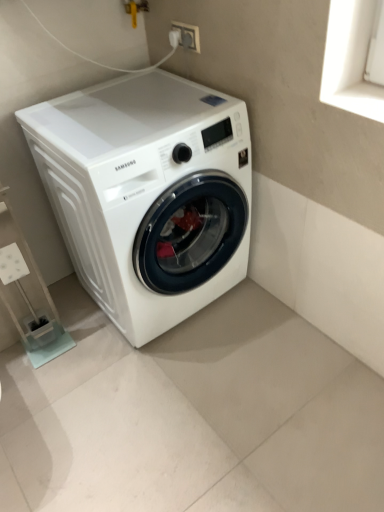
Question: Would you say white plastic shelf at lower left is inside or outside white plastic socket at upper center?

Choices:
 (A) outside
 (B) inside

Answer: (A)

Question: Is white plastic shelf at lower left bigger or smaller than white plastic socket at upper center?

Choices:
 (A) big
 (B) small

Answer: (A)

Question: Which object is positioned closest to the white plastic shelf at lower left?

Choices:
 (A) white glossy washing machine at center
 (B) white plastic socket at upper center

Answer: (A)

Question: Considering the real-world distances, which object is farthest from the white plastic shelf at lower left?

Choices:
 (A) white plastic socket at upper center
 (B) white glossy washing machine at center

Answer: (A)